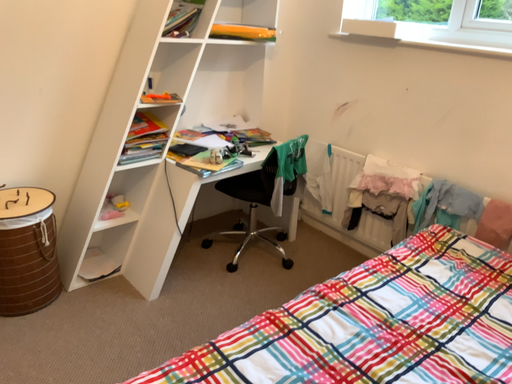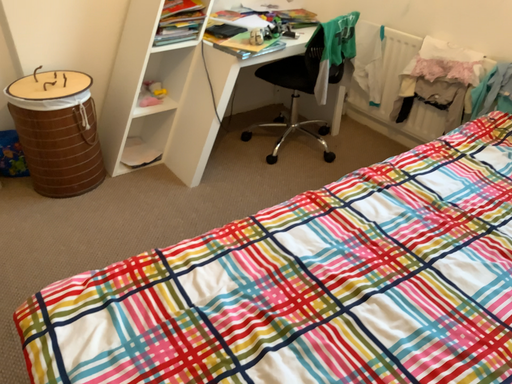
Question: Which way did the camera rotate in the video?

Choices:
 (A) rotated downward
 (B) rotated upward

Answer: (A)